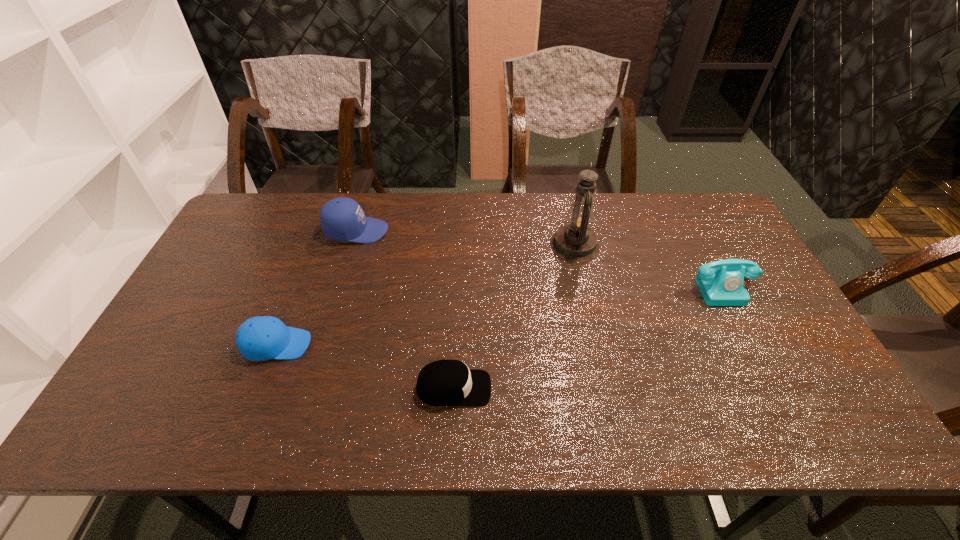
Where is `free spot between the telephone and the oil lamp`? free spot between the telephone and the oil lamp is located at coordinates (649, 266).

At what (x,y) coordinates should I click in order to perform the action: click on free space between the third farthest object and the tallest object. Please return your answer as a coordinate pair (x, y). This screenshot has width=960, height=540. Looking at the image, I should click on (649, 266).

The image size is (960, 540). What are the coordinates of `empty location between the second object from right to left and the telephone` in the screenshot? It's located at (649, 266).

Where is `the fourth closest object to the oil lamp`? the fourth closest object to the oil lamp is located at coordinates (261, 338).

Select which object is the fourth closest to the tallest cap. Please provide its 2D coordinates. Your answer should be formatted as a tuple, i.e. [(x, y)], where the tuple contains the x and y coordinates of a point satisfying the conditions above.

[(720, 283)]

This screenshot has height=540, width=960. Identify the location of cap that is the second closest to the third farthest object. (342, 219).

Locate an element on the screen. The image size is (960, 540). the closest cap to the tallest object is located at coordinates (445, 383).

The width and height of the screenshot is (960, 540). In order to click on vacant position in the image that satisfies the following two spatial constraints: 1. on the front-facing side of the tallest cap; 2. on the right side of the second object from right to left in this screenshot , I will do `click(352, 245)`.

Find the location of a particular element. Image resolution: width=960 pixels, height=540 pixels. vacant space that satisfies the following two spatial constraints: 1. on the dial of the third farthest object; 2. on the front-facing side of the second nearest object is located at coordinates (754, 345).

Locate an element on the screen. Image resolution: width=960 pixels, height=540 pixels. vacant space that satisfies the following two spatial constraints: 1. on the dial of the rightmost object; 2. on the front-facing side of the rightmost cap is located at coordinates (777, 388).